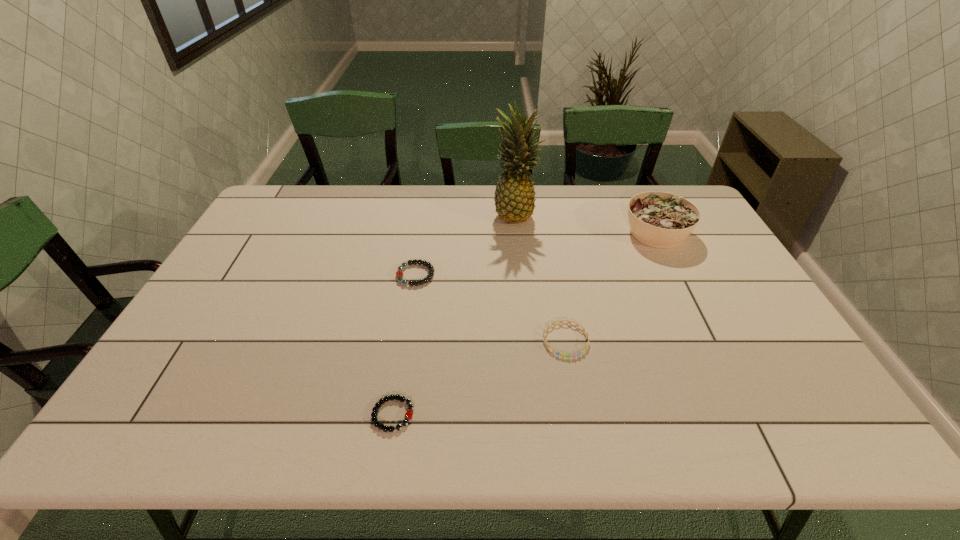
Where is `the tallest object`? the tallest object is located at coordinates (514, 198).

This screenshot has height=540, width=960. In order to click on the rightmost object in this screenshot , I will do `click(662, 220)`.

This screenshot has width=960, height=540. I want to click on salad, so 662,220.

Identify the location of the third farthest object. The height and width of the screenshot is (540, 960). click(399, 274).

You are a GUI agent. You are given a task and a screenshot of the screen. Output one action in this format:
    pyautogui.click(x=<x>, y=<y>)
    Task: Click on the fourth farthest object
    The width and height of the screenshot is (960, 540).
    Given the screenshot: What is the action you would take?
    pyautogui.click(x=569, y=322)

Locate an element on the screen. The width and height of the screenshot is (960, 540). the rightmost bracelet is located at coordinates (569, 322).

You are a GUI agent. You are given a task and a screenshot of the screen. Output one action in this format:
    pyautogui.click(x=<x>, y=<y>)
    Task: Click on the nearest bracelet
    Image resolution: width=960 pixels, height=540 pixels.
    Given the screenshot: What is the action you would take?
    pyautogui.click(x=408, y=415)

Locate an element on the screen. The width and height of the screenshot is (960, 540). vacant space located 0.100m on the right of the tallest object is located at coordinates (565, 214).

In order to click on vacant space situated 0.340m on the front of the salad in this screenshot , I will do `click(708, 338)`.

Locate an element on the screen. blank area located on the left of the third nearest object is located at coordinates (346, 275).